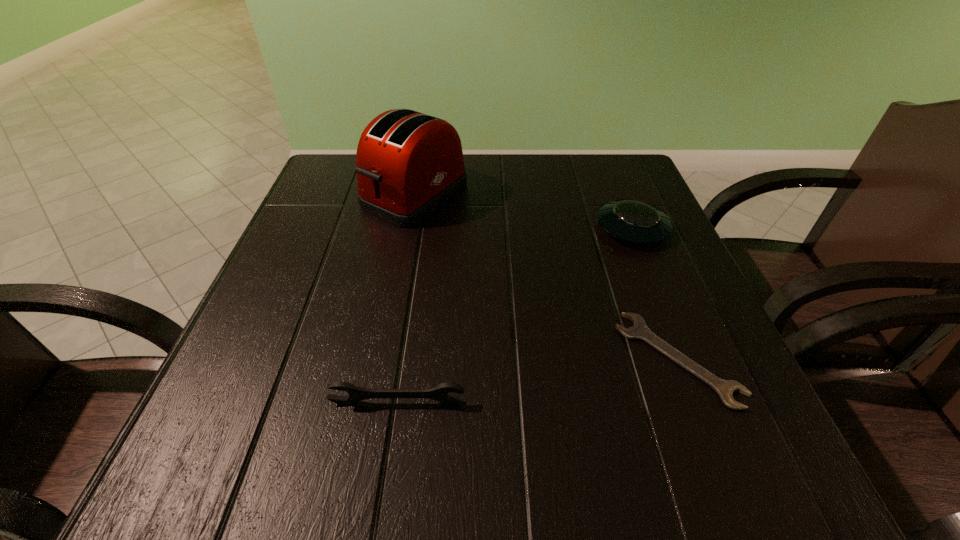
Where is `object positioned at the left edge`? The image size is (960, 540). object positioned at the left edge is located at coordinates 408,164.

Where is `saucer present at the right edge`? saucer present at the right edge is located at coordinates (633, 221).

Locate an element on the screen. This screenshot has width=960, height=540. wrench at the right edge is located at coordinates (639, 330).

Where is `object situated at the far left corner`? The image size is (960, 540). object situated at the far left corner is located at coordinates (408, 164).

Identify the location of blank space at the far edge of the desktop. point(498,180).

Image resolution: width=960 pixels, height=540 pixels. In the image, there is a desktop. Find the location of `free region at the near edge`. free region at the near edge is located at coordinates pyautogui.click(x=614, y=458).

The image size is (960, 540). Find the location of `free space at the left edge of the desktop`. free space at the left edge of the desktop is located at coordinates (248, 421).

In the image, there is a desktop. Where is `free region at the near left corner`? free region at the near left corner is located at coordinates (206, 431).

Identify the location of vacant area at the far right corner of the desktop. point(612,175).

Locate an element on the screen. The width and height of the screenshot is (960, 540). vacant point located between the toaster and the shortest object is located at coordinates (546, 277).